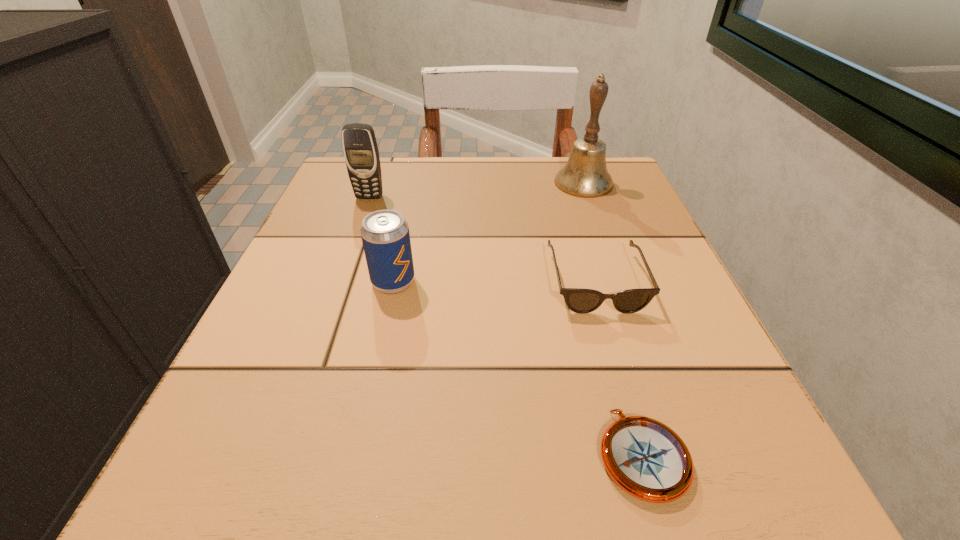
Where is `vacant area located on the back of the beer can`? The height and width of the screenshot is (540, 960). vacant area located on the back of the beer can is located at coordinates (414, 191).

Where is `vacant area situated 0.100m on the front lenses of the second shortest object`? The width and height of the screenshot is (960, 540). vacant area situated 0.100m on the front lenses of the second shortest object is located at coordinates (621, 367).

The image size is (960, 540). In order to click on vacant space located 0.050m on the back of the compass in this screenshot , I will do `click(620, 377)`.

Image resolution: width=960 pixels, height=540 pixels. Identify the location of bell positioned at the far edge. (585, 174).

Image resolution: width=960 pixels, height=540 pixels. I want to click on cellular telephone that is at the far edge, so click(360, 149).

At what (x,y) coordinates should I click in order to perform the action: click on object located in the near edge section of the desktop. Please return your answer as a coordinate pair (x, y). Image resolution: width=960 pixels, height=540 pixels. Looking at the image, I should click on (644, 457).

You are a GUI agent. You are given a task and a screenshot of the screen. Output one action in this format:
    pyautogui.click(x=<x>, y=<y>)
    Task: Click on the cellular telephone at the left edge
    
    Given the screenshot: What is the action you would take?
    point(360,149)

Where is `beer can present at the left edge`? The width and height of the screenshot is (960, 540). beer can present at the left edge is located at coordinates coord(385,235).

Locate an element on the screen. bell situated at the right edge is located at coordinates (585, 174).

Locate an element on the screen. sunglasses that is positioned at the right edge is located at coordinates (582, 301).